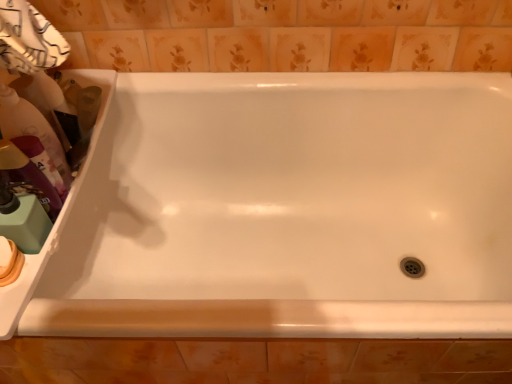
The width and height of the screenshot is (512, 384). Identify the location of beige matte soap at lower left. click(10, 262).

I want to click on matte plastic bottle at left, the 2th cleaning product from the top, so click(x=31, y=128).

What is the approximate width of matte plastic bottle at left, positioned as the third cleaning product in bottom-to-top order?

The width of matte plastic bottle at left, positioned as the third cleaning product in bottom-to-top order, is 3.58 inches.

What is the approximate height of white glossy sink at left?

It is 1.87 inches.

What is the approximate height of matte purple bottle at left, acting as the 3th cleaning product starting from the top?

The height of matte purple bottle at left, acting as the 3th cleaning product starting from the top, is 6.91 inches.

What do you see at coordinates (27, 178) in the screenshot? The image size is (512, 384). I see `matte purple bottle at left, acting as the 3th cleaning product starting from the top` at bounding box center [27, 178].

Looking at this image, how much space does matte plastic bottle at left, positioned as the 4th cleaning product in bottom-to-top order, occupy horizontally?

The width of matte plastic bottle at left, positioned as the 4th cleaning product in bottom-to-top order, is 3.58 inches.

Identify the location of matte green pump at left, which is counted as the fourth cleaning product, starting from the top. The image size is (512, 384). (24, 221).

You are a GUI agent. You are given a task and a screenshot of the screen. Output one action in this format:
    pyautogui.click(x=<x>, y=<y>)
    Task: Click on the beige matte soap at lower left
    The height and width of the screenshot is (384, 512).
    Given the screenshot: What is the action you would take?
    pyautogui.click(x=10, y=262)

Is white glossy sink at left at the back of matte plastic bottle at left, positioned as the 4th cleaning product in bottom-to-top order?

No.

From the image's perspective, is matte plastic bottle at left, which ranks as the 1th cleaning product in top-to-bottom order, located above or below white glossy sink at left?

Based on their image positions, matte plastic bottle at left, which ranks as the 1th cleaning product in top-to-bottom order, is located above white glossy sink at left.

Can you confirm if matte plastic bottle at left, positioned as the 4th cleaning product in bottom-to-top order, is bigger than white glossy sink at left?

Incorrect, matte plastic bottle at left, positioned as the 4th cleaning product in bottom-to-top order, is not larger than white glossy sink at left.

Considering the sizes of matte green pump at left, which is counted as the fourth cleaning product, starting from the top, and white glossy bathtub at center in the image, is matte green pump at left, which is counted as the fourth cleaning product, starting from the top, bigger or smaller than white glossy bathtub at center?

matte green pump at left, which is counted as the fourth cleaning product, starting from the top, is smaller than white glossy bathtub at center.

Between matte green pump at left, acting as the 1th cleaning product starting from the bottom, and white glossy bathtub at center, which one is positioned behind?

matte green pump at left, acting as the 1th cleaning product starting from the bottom, is behind.

Would you say matte green pump at left, which is counted as the fourth cleaning product, starting from the top, is outside white glossy bathtub at center?

Yes.

Is matte green pump at left, which is counted as the fourth cleaning product, starting from the top, positioned far away from white glossy bathtub at center?

No, matte green pump at left, which is counted as the fourth cleaning product, starting from the top, is not far from white glossy bathtub at center.

In the scene shown: Is matte plastic bottle at left, which ranks as the 1th cleaning product in top-to-bottom order, bigger or smaller than matte green pump at left, acting as the 1th cleaning product starting from the bottom?

Considering their sizes, matte plastic bottle at left, which ranks as the 1th cleaning product in top-to-bottom order, takes up more space than matte green pump at left, acting as the 1th cleaning product starting from the bottom.

Does matte plastic bottle at left, which ranks as the 1th cleaning product in top-to-bottom order, lie in front of matte green pump at left, acting as the 1th cleaning product starting from the bottom?

No, matte plastic bottle at left, which ranks as the 1th cleaning product in top-to-bottom order, is further to the viewer.

Would you say matte plastic bottle at left, which ranks as the 1th cleaning product in top-to-bottom order, is inside or outside matte green pump at left, which is counted as the fourth cleaning product, starting from the top?

matte plastic bottle at left, which ranks as the 1th cleaning product in top-to-bottom order, is outside matte green pump at left, which is counted as the fourth cleaning product, starting from the top.

Would you say white glossy sink at left is part of matte purple bottle at left, acting as the 3th cleaning product starting from the top,'s contents?

No.

From a real-world perspective, is matte purple bottle at left, which appears as the 2th cleaning product when ordered from the bottom, on top of white glossy sink at left?

Correct, in the physical world, matte purple bottle at left, which appears as the 2th cleaning product when ordered from the bottom, is higher than white glossy sink at left.

Can you tell me how much matte purple bottle at left, acting as the 3th cleaning product starting from the top, and white glossy sink at left differ in facing direction?

The angle between the facing direction of matte purple bottle at left, acting as the 3th cleaning product starting from the top, and the facing direction of white glossy sink at left is 0.00183 degrees.

From the picture: Which point is more forward, [59,202] or [73,195]?

Positioned in front is point [59,202].

Does beige matte soap at lower left come behind matte green pump at left, which is counted as the fourth cleaning product, starting from the top?

Yes, the depth of beige matte soap at lower left is greater than that of matte green pump at left, which is counted as the fourth cleaning product, starting from the top.

Consider the image. How different are the orientations of beige matte soap at lower left and matte green pump at left, which is counted as the fourth cleaning product, starting from the top, in degrees?

The angle between the facing direction of beige matte soap at lower left and the facing direction of matte green pump at left, which is counted as the fourth cleaning product, starting from the top, is 0.00288 degrees.

Based on their sizes in the image, would you say beige matte soap at lower left is bigger or smaller than matte green pump at left, acting as the 1th cleaning product starting from the bottom?

Considering their sizes, beige matte soap at lower left takes up less space than matte green pump at left, acting as the 1th cleaning product starting from the bottom.

Which is behind, point (3, 270) or point (10, 226)?

Point (10, 226)

Is matte green pump at left, acting as the 1th cleaning product starting from the bottom, positioned far away from white glossy sink at left?

No, matte green pump at left, acting as the 1th cleaning product starting from the bottom, is not far away from white glossy sink at left.

From the picture: How many degrees apart are the facing directions of matte green pump at left, which is counted as the fourth cleaning product, starting from the top, and white glossy sink at left?

They differ by 0.000522 degrees in their facing directions.

Considering their positions, is matte green pump at left, which is counted as the fourth cleaning product, starting from the top, located in front of or behind white glossy sink at left?

In the image, matte green pump at left, which is counted as the fourth cleaning product, starting from the top, appears behind white glossy sink at left.

Is matte green pump at left, acting as the 1th cleaning product starting from the bottom, oriented towards white glossy sink at left?

No.

Considering the positions of objects beige matte soap at lower left and matte purple bottle at left, acting as the 3th cleaning product starting from the top, in the image provided, who is more to the left, beige matte soap at lower left or matte purple bottle at left, acting as the 3th cleaning product starting from the top,?

beige matte soap at lower left is more to the left.

Which of these two, beige matte soap at lower left or matte purple bottle at left, which appears as the 2th cleaning product when ordered from the bottom, is bigger?

matte purple bottle at left, which appears as the 2th cleaning product when ordered from the bottom.

Based on the photo, can matte purple bottle at left, which appears as the 2th cleaning product when ordered from the bottom, be found inside beige matte soap at lower left?

Actually, matte purple bottle at left, which appears as the 2th cleaning product when ordered from the bottom, is outside beige matte soap at lower left.

Considering the relative sizes of beige matte soap at lower left and matte purple bottle at left, which appears as the 2th cleaning product when ordered from the bottom, in the image provided, is beige matte soap at lower left shorter than matte purple bottle at left, which appears as the 2th cleaning product when ordered from the bottom,?

Yes.

Find the location of `the 4th cleaning product to the right of the white glossy sink at left, starting your count from the anchor`. the 4th cleaning product to the right of the white glossy sink at left, starting your count from the anchor is located at coordinates (50, 105).

Identify the location of the 1st cleaning product positioned above the white glossy bathtub at center (from a real-world perspective). Image resolution: width=512 pixels, height=384 pixels. 24,221.

Based on their spatial positions, is beige matte soap at lower left or matte plastic bottle at left, which ranks as the 1th cleaning product in top-to-bottom order, closer to matte plastic bottle at left, positioned as the third cleaning product in bottom-to-top order?

Among the two, matte plastic bottle at left, which ranks as the 1th cleaning product in top-to-bottom order, is located nearer to matte plastic bottle at left, positioned as the third cleaning product in bottom-to-top order.

Considering their positions, is matte purple bottle at left, acting as the 3th cleaning product starting from the top, positioned further to white glossy sink at left than matte plastic bottle at left, which ranks as the 1th cleaning product in top-to-bottom order?

matte purple bottle at left, acting as the 3th cleaning product starting from the top, lies further to white glossy sink at left than the other object.

Which object lies further to the anchor point matte plastic bottle at left, positioned as the third cleaning product in bottom-to-top order, matte purple bottle at left, which appears as the 2th cleaning product when ordered from the bottom, or matte plastic bottle at left, positioned as the 4th cleaning product in bottom-to-top order?

matte purple bottle at left, which appears as the 2th cleaning product when ordered from the bottom, is positioned further to the anchor matte plastic bottle at left, positioned as the third cleaning product in bottom-to-top order.

Which object lies nearer to the anchor point matte plastic bottle at left, positioned as the third cleaning product in bottom-to-top order, matte green pump at left, which is counted as the fourth cleaning product, starting from the top, or white glossy bathtub at center?

matte green pump at left, which is counted as the fourth cleaning product, starting from the top, lies closer to matte plastic bottle at left, positioned as the third cleaning product in bottom-to-top order, than the other object.

From the image, which object appears to be farther from white glossy bathtub at center, white glossy sink at left or matte plastic bottle at left, the 2th cleaning product from the top?

matte plastic bottle at left, the 2th cleaning product from the top, is positioned further to the anchor white glossy bathtub at center.

When comparing their distances from white glossy bathtub at center, does matte plastic bottle at left, positioned as the third cleaning product in bottom-to-top order, or matte plastic bottle at left, positioned as the 4th cleaning product in bottom-to-top order, seem further?

matte plastic bottle at left, positioned as the third cleaning product in bottom-to-top order, is positioned further to the anchor white glossy bathtub at center.

Based on their spatial positions, is matte green pump at left, acting as the 1th cleaning product starting from the bottom, or matte plastic bottle at left, positioned as the third cleaning product in bottom-to-top order, further from white glossy bathtub at center?

The object further to white glossy bathtub at center is matte green pump at left, acting as the 1th cleaning product starting from the bottom.

When comparing their distances from matte plastic bottle at left, which ranks as the 1th cleaning product in top-to-bottom order, does white glossy bathtub at center or matte green pump at left, which is counted as the fourth cleaning product, starting from the top, seem further?

white glossy bathtub at center.

The height and width of the screenshot is (384, 512). Find the location of `sink between matte purple bottle at left, which appears as the 2th cleaning product when ordered from the bottom, and matte green pump at left, acting as the 1th cleaning product starting from the bottom, from top to bottom`. sink between matte purple bottle at left, which appears as the 2th cleaning product when ordered from the bottom, and matte green pump at left, acting as the 1th cleaning product starting from the bottom, from top to bottom is located at coordinates (31, 273).

Identify the location of cleaning product between matte plastic bottle at left, the 2th cleaning product from the top, and white glossy sink at left vertically. This screenshot has width=512, height=384. (27, 178).

Find the location of a particular element. cleaning product between matte plastic bottle at left, positioned as the third cleaning product in bottom-to-top order, and white glossy bathtub at center is located at coordinates (50, 105).

Image resolution: width=512 pixels, height=384 pixels. Identify the location of sink between matte plastic bottle at left, positioned as the third cleaning product in bottom-to-top order, and beige matte soap at lower left, in the vertical direction. (31, 273).